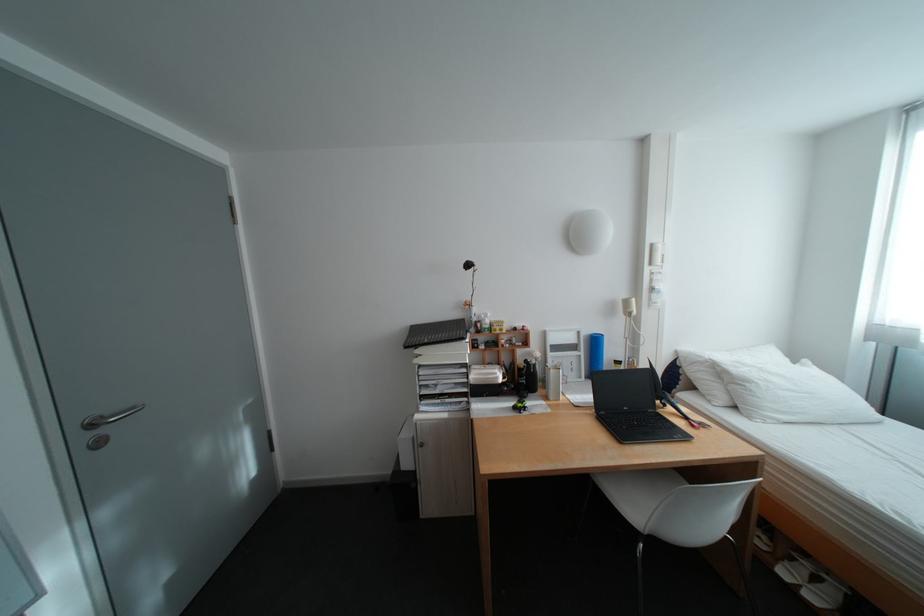
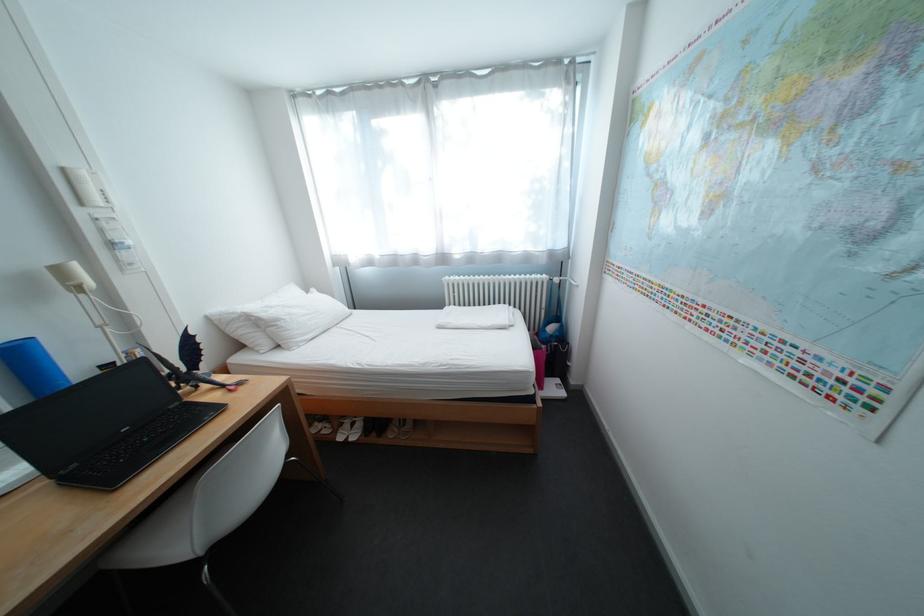
The point at [799,564] is marked in the first image. Where is the corresponding point in the second image?

(353, 431)